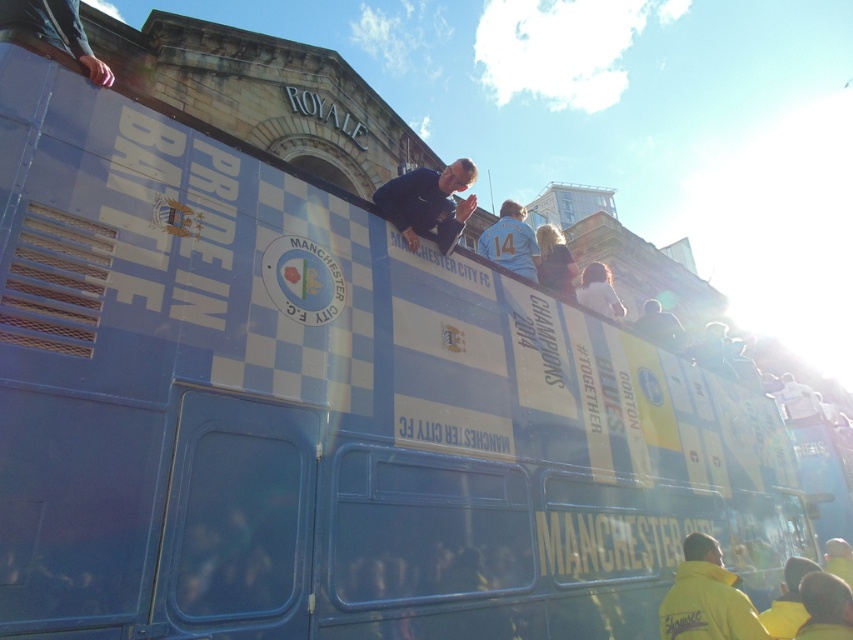
Question: Is white jersey at center positioned at the back of white fabric at upper center?

Choices:
 (A) yes
 (B) no

Answer: (B)

Question: Considering the real-world distances, which object is closest to the blue fabric jacket at center?

Choices:
 (A) yellow matte jacket at lower right
 (B) yellow fabric person at lower right

Answer: (A)

Question: Which object is positioned farthest from the white fabric at upper center?

Choices:
 (A) blue fabric jacket at center
 (B) white jersey at center

Answer: (B)

Question: Does blue fabric jacket at center have a smaller size compared to white jersey at center?

Choices:
 (A) no
 (B) yes

Answer: (B)

Question: Is the position of yellow fabric person at lower right more distant than that of white jersey at center?

Choices:
 (A) yes
 (B) no

Answer: (B)

Question: Which object appears closest to the camera in this image?

Choices:
 (A) yellow matte jacket at lower right
 (B) white fabric at upper center
 (C) blue fabric jacket at center

Answer: (A)